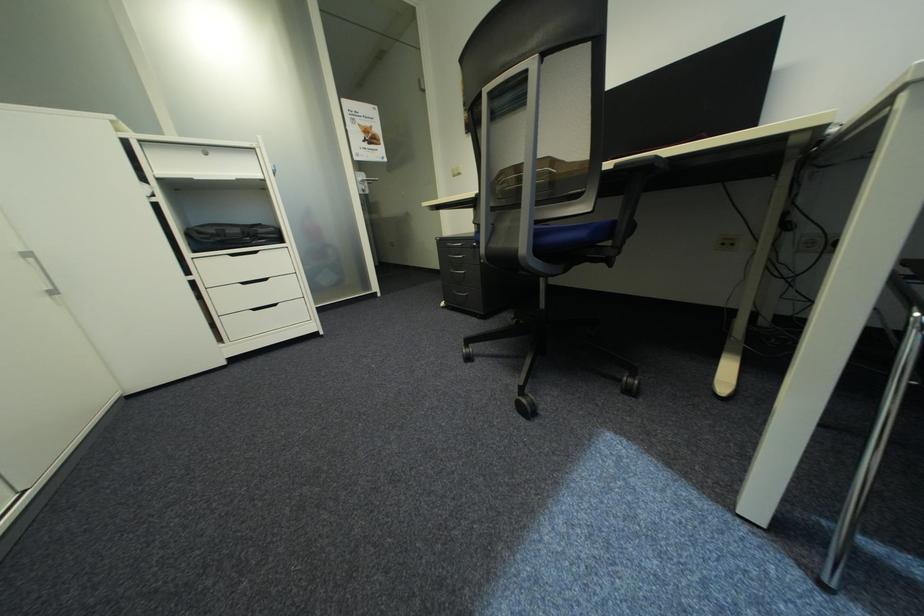
Find where to lift the black bag. Please return your answer as a coordinate pair (x, y).

(231, 236)